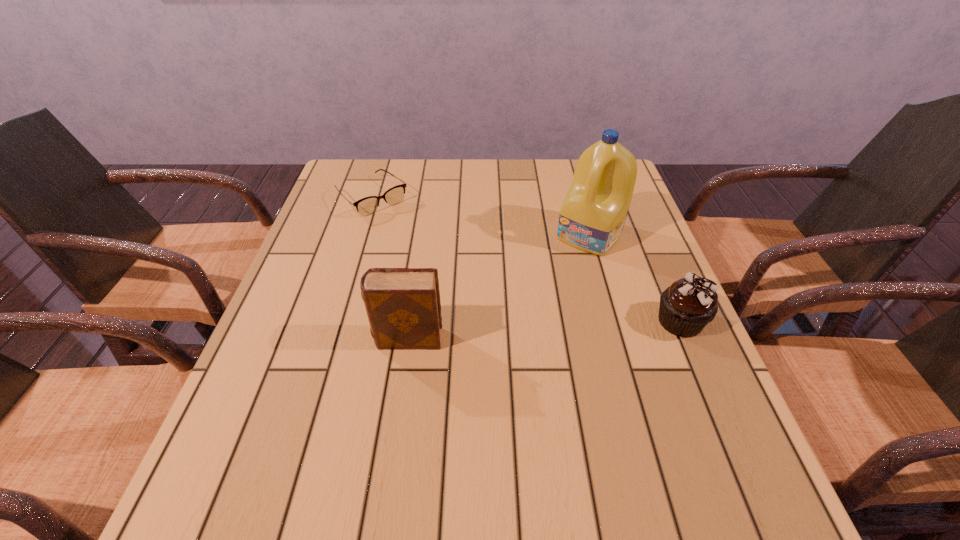
The height and width of the screenshot is (540, 960). I want to click on diary, so click(403, 306).

Image resolution: width=960 pixels, height=540 pixels. I want to click on the second shortest object, so click(689, 304).

At what (x,y) coordinates should I click in order to perform the action: click on the shortest object. Please return your answer as a coordinate pair (x, y). Looking at the image, I should click on (366, 206).

The height and width of the screenshot is (540, 960). Find the location of `the tallest object`. the tallest object is located at coordinates (592, 216).

The image size is (960, 540). What are the coordinates of `free space located 0.210m on the spine side of the third shortest object` in the screenshot? It's located at (276, 339).

Where is `vacant position located on the spine side of the third shortest object`? The image size is (960, 540). vacant position located on the spine side of the third shortest object is located at coordinates (284, 339).

The image size is (960, 540). In order to click on vacant area situated on the spine side of the third shortest object in this screenshot , I will do `click(341, 339)`.

At what (x,y) coordinates should I click in order to perform the action: click on vacant space situated on the left of the second shortest object. Please return your answer as a coordinate pair (x, y). This screenshot has width=960, height=540. Looking at the image, I should click on (605, 321).

This screenshot has height=540, width=960. What are the coordinates of `vacant space situated 0.200m on the face of the spectacles` in the screenshot? It's located at (427, 252).

Identify the location of vacant area located 0.190m on the face of the spectacles. The height and width of the screenshot is (540, 960). (425, 250).